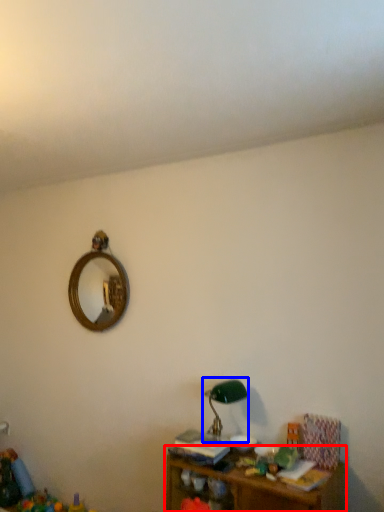
Question: Which of the following is the farthest to the observer, shelf (highlighted by a red box) or table lamp (highlighted by a blue box)?

Choices:
 (A) shelf
 (B) table lamp

Answer: (B)